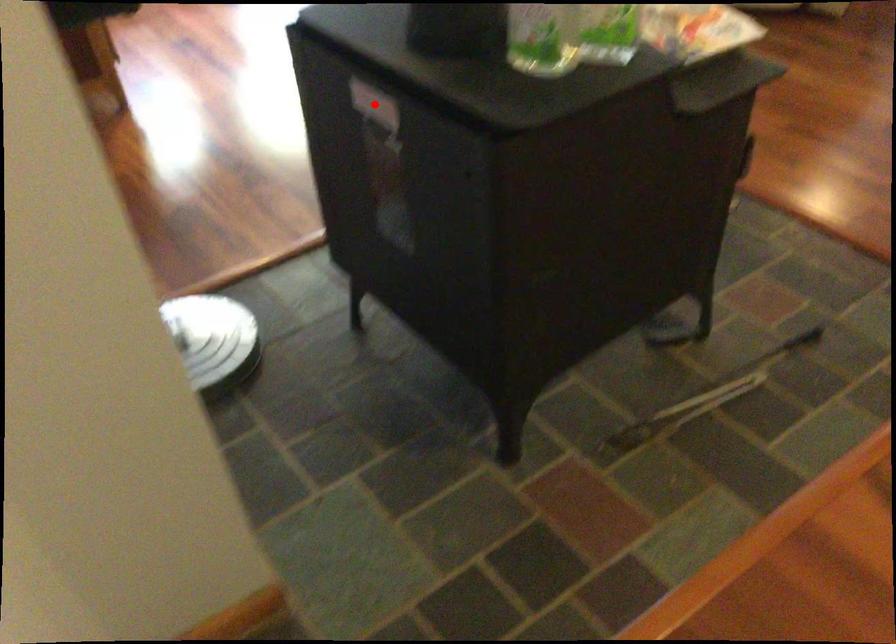
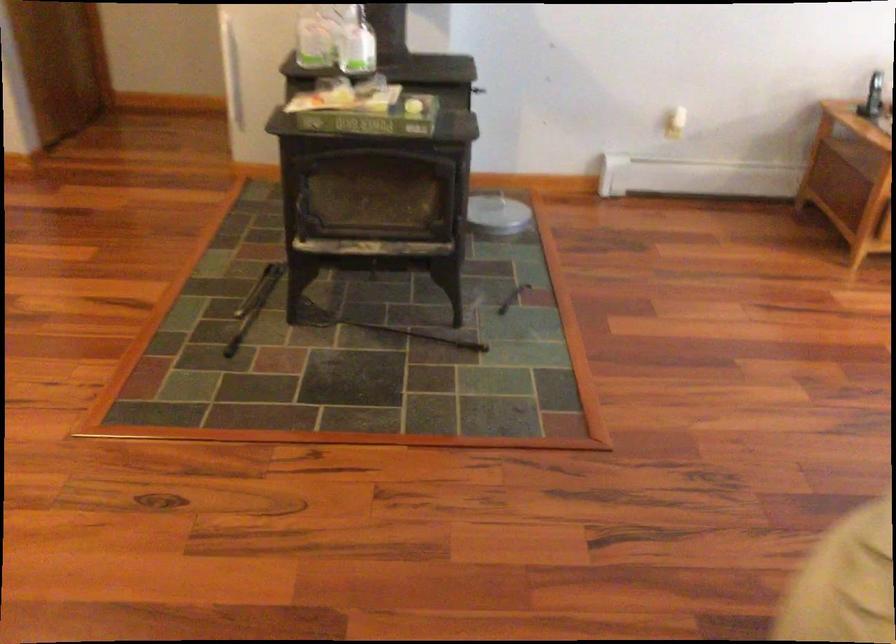
Question: I am providing you with two images of the same scene from different viewpoints. A red point is marked on the first image. Can you still see the location of the red point in image 2?

Choices:
 (A) Yes
 (B) No

Answer: (B)